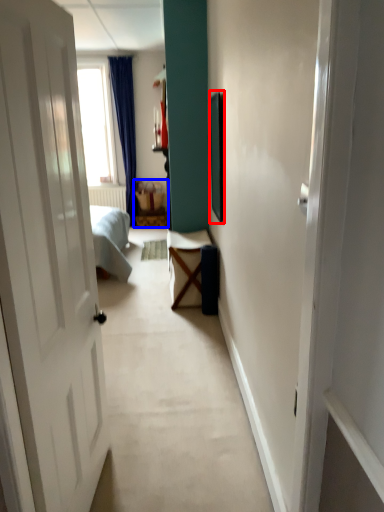
Question: Which of the following is the closest to the observer, picture frame (highlighted by a red box) or furniture (highlighted by a blue box)?

Choices:
 (A) picture frame
 (B) furniture

Answer: (A)